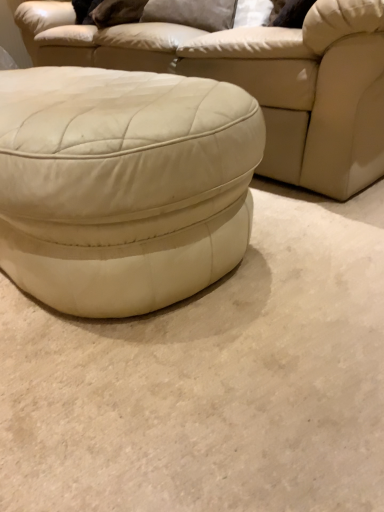
Question: Based on their positions, is white leather ottoman at center located to the left or right of white leather ottoman at center?

Choices:
 (A) left
 (B) right

Answer: (B)

Question: Would you say white leather ottoman at center is inside or outside white leather ottoman at center?

Choices:
 (A) outside
 (B) inside

Answer: (A)

Question: Which object is the closest to the suede-like gray pillow at upper center?

Choices:
 (A) white leather ottoman at center
 (B) white leather ottoman at center
 (C) matte white ottoman at center

Answer: (C)

Question: Based on their relative distances, which object is farther from the white leather ottoman at center?

Choices:
 (A) suede-like gray pillow at upper center
 (B) matte white ottoman at center
 (C) white leather ottoman at center

Answer: (A)